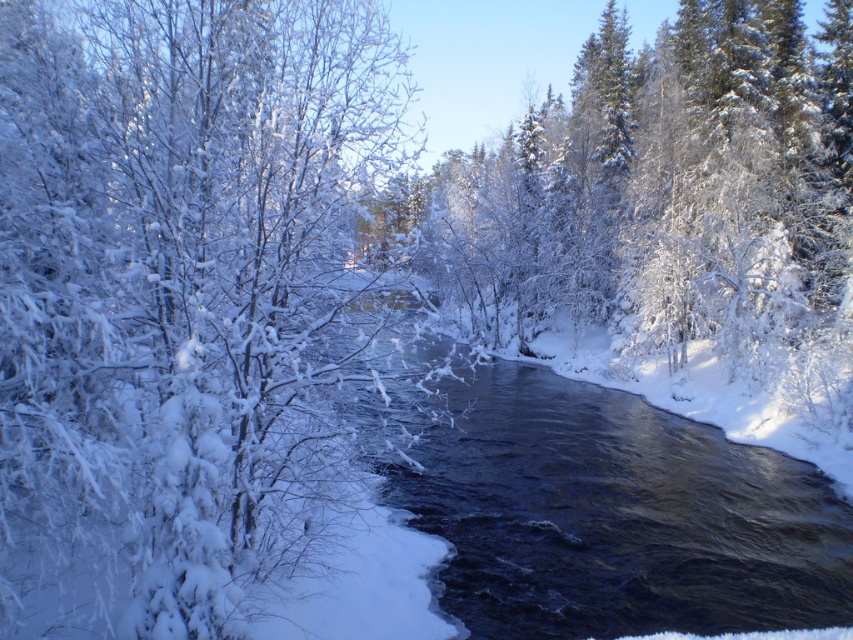
Question: Among these objects, which one is nearest to the camera?

Choices:
 (A) dark blue water at center
 (B) snowy white branches at left

Answer: (B)

Question: Which point is closer to the camera?

Choices:
 (A) (135, 156)
 (B) (386, 436)

Answer: (A)

Question: Does snowy white branches at left lie behind dark blue water at center?

Choices:
 (A) yes
 (B) no

Answer: (B)

Question: In this image, where is snowy white branches at left located relative to dark blue water at center?

Choices:
 (A) below
 (B) above

Answer: (B)

Question: Which point is farther to the camera?

Choices:
 (A) (42, 209)
 (B) (468, 508)

Answer: (B)

Question: Is snowy white branches at left closer to the viewer compared to dark blue water at center?

Choices:
 (A) no
 (B) yes

Answer: (B)